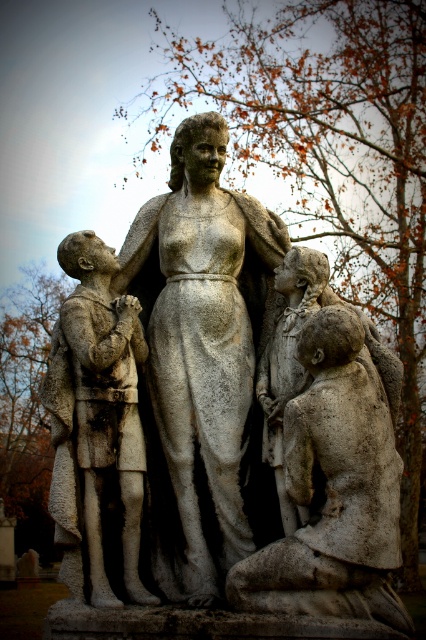
You are an art conservator examining the stone statues in the image. You need to place a protective covering over both the white stone statue at center and the stone statue of boy at left. Based on their positions, which statue should you cover first to avoid obstructing the other?

The white stone statue at center is positioned over the stone statue of boy at left, so you should cover the stone statue of boy at left first to avoid blocking it with the covering from the statue above.

You are standing in front of the weathered stone sculpture of a woman and three children. You notice a specific point at coordinates (232, 426). What object is located at this point?

The white stone statue at center is located at point (232, 426).

You are an art conservator examining the sculpture from a distance. You notice two points on the sculpture marked at coordinates point (377, 428) and point (284, 396). Which point is positioned closer to your viewpoint?

Point (377, 428) is closer to the viewer than point (284, 396) according to the spatial description provided.